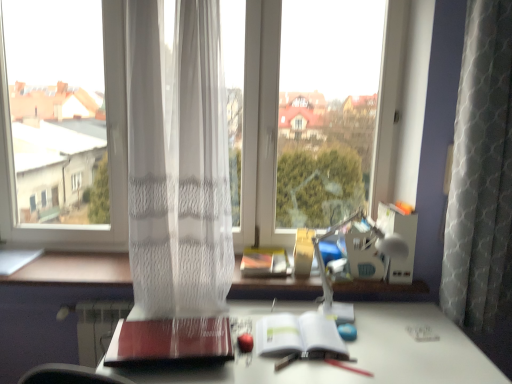
The width and height of the screenshot is (512, 384). I want to click on transparent fabric at center, so click(x=108, y=149).

What do you see at coordinates (53, 306) in the screenshot? The width and height of the screenshot is (512, 384). I see `white matte computer desk at center` at bounding box center [53, 306].

How much space does matte red notebook at center, positioned as the second paperback book in right-to-left order, occupy horizontally?

The width of matte red notebook at center, positioned as the second paperback book in right-to-left order, is 13.07 inches.

Find the location of a particular element. white paper at center, which is counted as the 1th paperback book, starting from the right is located at coordinates (298, 335).

Is white paper at center, positioned as the second paperback book in left-to-right order, smaller than white matte computer desk at center?

Yes.

Locate an element on the screen. The height and width of the screenshot is (384, 512). the 2nd paperback book behind when counting from the white matte computer desk at center is located at coordinates (298, 335).

From a real-world perspective, which object stands above the other?

In real-world perspective, white matte computer desk at center is above.

Is white paper at center, which is counted as the 1th paperback book, starting from the right, in contact with white matte computer desk at center?

No, white paper at center, which is counted as the 1th paperback book, starting from the right, is not next to white matte computer desk at center.

From a real-world perspective, is white paper at center, positioned as the second paperback book in left-to-right order, positioned above or below white glossy desk at center?

white paper at center, positioned as the second paperback book in left-to-right order, is above white glossy desk at center.

Between white paper at center, positioned as the second paperback book in left-to-right order, and white glossy desk at center, which one is positioned in front?

white glossy desk at center is in front.

In the scene shown: Considering the relative sizes of white paper at center, which is counted as the 1th paperback book, starting from the right, and white glossy desk at center in the image provided, is white paper at center, which is counted as the 1th paperback book, starting from the right, bigger than white glossy desk at center?

Actually, white paper at center, which is counted as the 1th paperback book, starting from the right, might be smaller than white glossy desk at center.

From the image's perspective, is white paper at center, positioned as the second paperback book in left-to-right order, on white glossy desk at center?

Indeed, from the image's perspective, white paper at center, positioned as the second paperback book in left-to-right order, is shown above white glossy desk at center.

Image resolution: width=512 pixels, height=384 pixels. I want to click on paperback book on the left side of white paper at center, positioned as the second paperback book in left-to-right order, so click(170, 341).

Considering their positions, is matte red notebook at center, the 1th paperback book viewed from the left, located in front of or behind white paper at center, which is counted as the 1th paperback book, starting from the right?

Clearly, matte red notebook at center, the 1th paperback book viewed from the left, is in front of white paper at center, which is counted as the 1th paperback book, starting from the right.

From the image's perspective, is matte red notebook at center, positioned as the second paperback book in right-to-left order, above or below white paper at center, which is counted as the 1th paperback book, starting from the right?

Clearly, from the image's perspective, matte red notebook at center, positioned as the second paperback book in right-to-left order, is below white paper at center, which is counted as the 1th paperback book, starting from the right.

Considering the positions of point (110, 343) and point (275, 348), is point (110, 343) closer or farther from the camera than point (275, 348)?

Point (110, 343).

Could you tell me if transparent fabric at center is turned towards white matte computer desk at center?

Yes, transparent fabric at center is oriented towards white matte computer desk at center.

Which of these two, transparent fabric at center or white matte computer desk at center, is bigger?

white matte computer desk at center.

Is white matte computer desk at center a part of transparent fabric at center?

Definitely not — white matte computer desk at center is not inside transparent fabric at center.

From the image's perspective, between white glossy desk at center and transparent fabric at center, who is located below?

white glossy desk at center appears lower in the image.

Is white glossy desk at center next to transparent fabric at center and touching it?

No, white glossy desk at center is not with transparent fabric at center.

Is white glossy desk at center facing towards transparent fabric at center?

No, white glossy desk at center is not turned towards transparent fabric at center.

From the image's perspective, between white paper at center, positioned as the second paperback book in left-to-right order, and transparent fabric at center, which one is located above?

transparent fabric at center is shown above in the image.

From a real-world perspective, between white paper at center, which is counted as the 1th paperback book, starting from the right, and transparent fabric at center, who is vertically lower?

In real-world perspective, white paper at center, which is counted as the 1th paperback book, starting from the right, is lower.

Relative to transparent fabric at center, is white paper at center, positioned as the second paperback book in left-to-right order, in front or behind?

Clearly, white paper at center, positioned as the second paperback book in left-to-right order, is in front of transparent fabric at center.

Considering the points (192, 338) and (233, 317), which point is behind, point (192, 338) or point (233, 317)?

The point (233, 317) is more distant.

Is matte red notebook at center, positioned as the second paperback book in right-to-left order, not close to white glossy desk at center?

matte red notebook at center, positioned as the second paperback book in right-to-left order, is near white glossy desk at center, not far away.

From the image's perspective, which is above, matte red notebook at center, positioned as the second paperback book in right-to-left order, or white glossy desk at center?

matte red notebook at center, positioned as the second paperback book in right-to-left order, is shown above in the image.

Where is `paperback book that is the 2nd object directly below the white matte computer desk at center (from a real-world perspective)`? The image size is (512, 384). paperback book that is the 2nd object directly below the white matte computer desk at center (from a real-world perspective) is located at coordinates (298, 335).

Locate an element on the screen. The width and height of the screenshot is (512, 384). paperback book that is the 2nd one when counting backward from the white glossy desk at center is located at coordinates (298, 335).

From the picture: Based on their spatial positions, is matte red notebook at center, positioned as the second paperback book in right-to-left order, or white glossy desk at center closer to white sheer curtain at center?

matte red notebook at center, positioned as the second paperback book in right-to-left order.

Estimate the real-world distances between objects in this image. Which object is closer to white sheer curtain at center, matte red notebook at center, the 1th paperback book viewed from the left, or transparent fabric at center?

transparent fabric at center.

When comparing their distances from white paper at center, positioned as the second paperback book in left-to-right order, does white glossy desk at center or transparent fabric at center seem closer?

white glossy desk at center is positioned closer to the anchor white paper at center, positioned as the second paperback book in left-to-right order.

Which object lies nearer to the anchor point white sheer curtain at center, matte red notebook at center, the 1th paperback book viewed from the left, or white paper at center, which is counted as the 1th paperback book, starting from the right?

matte red notebook at center, the 1th paperback book viewed from the left.

Based on their spatial positions, is white matte computer desk at center or transparent fabric at center further from white glossy desk at center?

transparent fabric at center is further to white glossy desk at center.

Estimate the real-world distances between objects in this image. Which object is closer to white sheer curtain at center, white glossy desk at center or white paper at center, positioned as the second paperback book in left-to-right order?

white paper at center, positioned as the second paperback book in left-to-right order, lies closer to white sheer curtain at center than the other object.

Based on their spatial positions, is white sheer curtain at center or white matte computer desk at center closer to white paper at center, positioned as the second paperback book in left-to-right order?

Among the two, white sheer curtain at center is located nearer to white paper at center, positioned as the second paperback book in left-to-right order.

Which object lies further to the anchor point white matte computer desk at center, white sheer curtain at center or white glossy desk at center?

white glossy desk at center is further to white matte computer desk at center.

The height and width of the screenshot is (384, 512). What are the coordinates of `paperback book between white sheer curtain at center and matte red notebook at center, the 1th paperback book viewed from the left, in the vertical direction` in the screenshot? It's located at (298, 335).

Find the location of a particular element. desk located between white matte computer desk at center and white paper at center, positioned as the second paperback book in left-to-right order, in the depth direction is located at coordinates (352, 352).

This screenshot has height=384, width=512. Identify the location of desk between white matte computer desk at center and matte red notebook at center, the 1th paperback book viewed from the left, along the z-axis. (352, 352).

The height and width of the screenshot is (384, 512). Identify the location of desk located between matte red notebook at center, the 1th paperback book viewed from the left, and white paper at center, positioned as the second paperback book in left-to-right order, in the left-right direction. (352, 352).